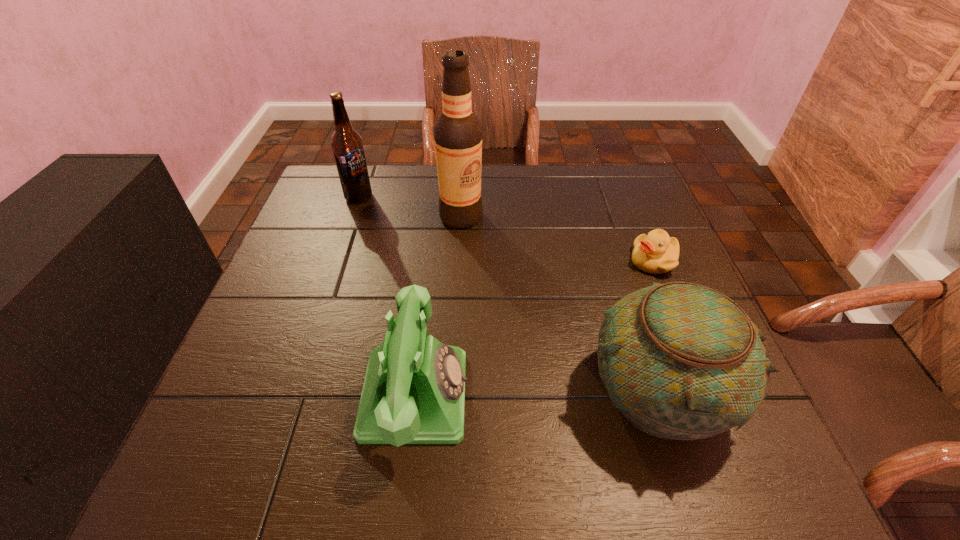
The image size is (960, 540). What are the coordinates of `telephone` in the screenshot? It's located at (414, 390).

The height and width of the screenshot is (540, 960). Find the location of `pottery`. pottery is located at coordinates (679, 360).

You are a GUI agent. You are given a task and a screenshot of the screen. Output one action in this format:
    pyautogui.click(x=<x>, y=<y>)
    Task: Click on the third farthest object
    This screenshot has height=540, width=960.
    Given the screenshot: What is the action you would take?
    pyautogui.click(x=655, y=253)

The width and height of the screenshot is (960, 540). I want to click on duckling, so click(655, 253).

Identify the location of the tallest object. (457, 132).

Where is `the leftmost object`? the leftmost object is located at coordinates (346, 143).

At what (x,y) coordinates should I click in order to perform the action: click on the fourth shortest object. Please return your answer as a coordinate pair (x, y). Looking at the image, I should click on (346, 143).

You are a GUI agent. You are given a task and a screenshot of the screen. Output one action in this format:
    pyautogui.click(x=<x>, y=<y>)
    Task: Click on the free space located on the dial of the fourth tallest object
    
    Given the screenshot: What is the action you would take?
    pyautogui.click(x=561, y=394)

The image size is (960, 540). What are the coordinates of `free space located on the left of the pottery` in the screenshot? It's located at (511, 390).

What are the coordinates of `vacant area situated 0.160m on the front-facing side of the duckling` in the screenshot? It's located at (609, 314).